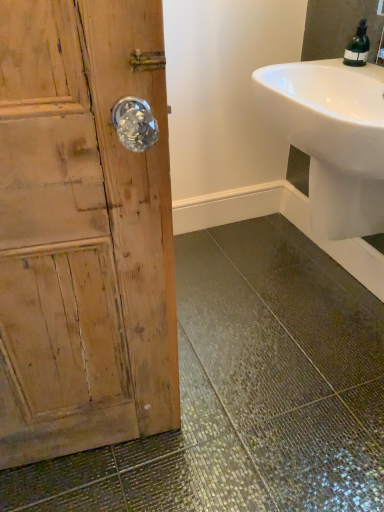
Question: Does green matte bottle at upper right have a lesser width compared to white glossy sink at upper right?

Choices:
 (A) yes
 (B) no

Answer: (A)

Question: From a real-world perspective, is green matte bottle at upper right positioned under white glossy sink at upper right based on gravity?

Choices:
 (A) no
 (B) yes

Answer: (A)

Question: Does green matte bottle at upper right appear on the right side of white glossy sink at upper right?

Choices:
 (A) yes
 (B) no

Answer: (A)

Question: From the image's perspective, is green matte bottle at upper right located above white glossy sink at upper right?

Choices:
 (A) yes
 (B) no

Answer: (A)

Question: Is green matte bottle at upper right at the left side of white glossy sink at upper right?

Choices:
 (A) no
 (B) yes

Answer: (A)

Question: Could you tell me if green matte bottle at upper right is turned towards white glossy sink at upper right?

Choices:
 (A) no
 (B) yes

Answer: (A)

Question: Is white glossy sink at upper right not close to green matte bottle at upper right?

Choices:
 (A) yes
 (B) no

Answer: (B)

Question: Is white glossy sink at upper right in contact with green matte bottle at upper right?

Choices:
 (A) no
 (B) yes

Answer: (A)

Question: Would you say white glossy sink at upper right contains green matte bottle at upper right?

Choices:
 (A) yes
 (B) no

Answer: (B)

Question: Is white glossy sink at upper right wider than green matte bottle at upper right?

Choices:
 (A) no
 (B) yes

Answer: (B)

Question: From the image's perspective, is white glossy sink at upper right over green matte bottle at upper right?

Choices:
 (A) no
 (B) yes

Answer: (A)

Question: Is white glossy sink at upper right oriented away from green matte bottle at upper right?

Choices:
 (A) no
 (B) yes

Answer: (A)

Question: From a real-world perspective, is white glossy sink at upper right physically located above or below green matte bottle at upper right?

Choices:
 (A) below
 (B) above

Answer: (A)